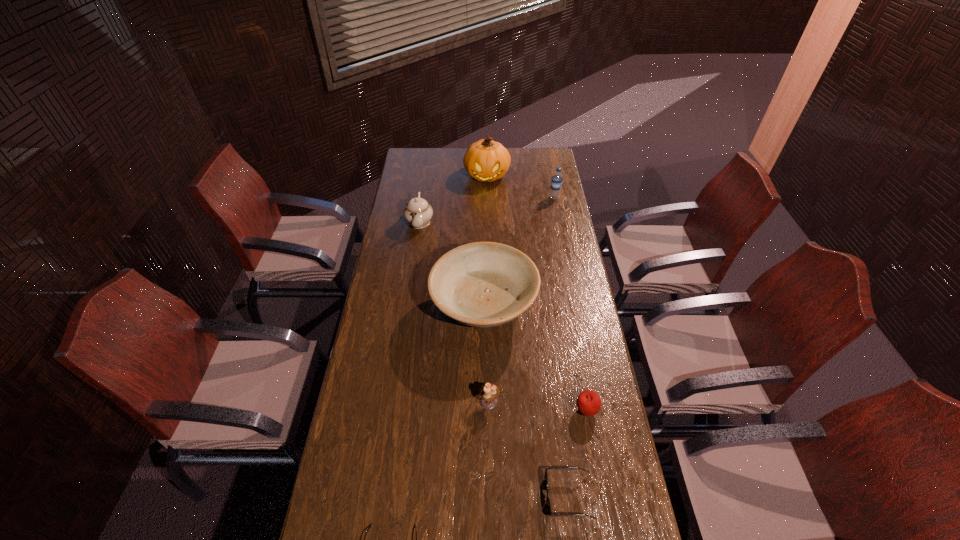
This screenshot has height=540, width=960. I want to click on free space between the seventh farthest object and the candle holder, so click(x=529, y=449).

You are a GUI agent. You are given a task and a screenshot of the screen. Output one action in this format:
    pyautogui.click(x=<x>, y=<y>)
    Task: Click on the object that is the second nearest to the candle holder
    This screenshot has height=540, width=960.
    Given the screenshot: What is the action you would take?
    pyautogui.click(x=559, y=468)

Locate an element on the screen. This screenshot has height=540, width=960. object that is the third closest to the water bottle is located at coordinates (418, 212).

At what (x,y) coordinates should I click in order to perform the action: click on free space that satisfies the following two spatial constraints: 1. at the spout of the fourth farthest object; 2. on the left side of the chinaware. Please return your answer as a coordinate pair (x, y). This screenshot has height=540, width=960. Looking at the image, I should click on click(x=407, y=308).

Where is `vacant space that satisfies the following two spatial constraints: 1. on the front face of the third shortest object; 2. on the right side of the tallest object`? The height and width of the screenshot is (540, 960). vacant space that satisfies the following two spatial constraints: 1. on the front face of the third shortest object; 2. on the right side of the tallest object is located at coordinates (492, 410).

The height and width of the screenshot is (540, 960). Find the location of `vacant area in the image that satisfies the following two spatial constraints: 1. at the spout of the candle holder; 2. on the left side of the third farthest object`. vacant area in the image that satisfies the following two spatial constraints: 1. at the spout of the candle holder; 2. on the left side of the third farthest object is located at coordinates (393, 401).